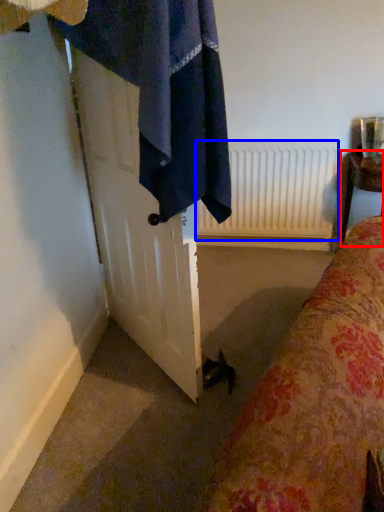
Question: Which of the following is the closest to the observer, furniture (highlighted by a red box) or radiator (highlighted by a blue box)?

Choices:
 (A) furniture
 (B) radiator

Answer: (A)